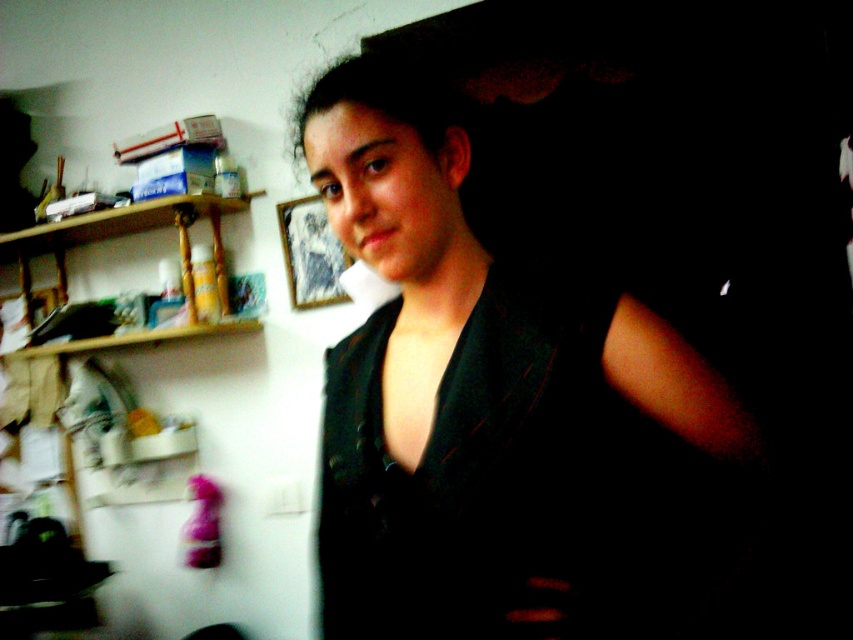
You are organizing a fashion show and need to decide which dress to display first. The black matte dress at center and the black satin dress at center are both contenders. Based on their width, which dress should you choose if you want the wider one to be first?

The black matte dress at center is wider than the black satin dress at center, so you should choose the black matte dress at center to display first if you want the wider one first.